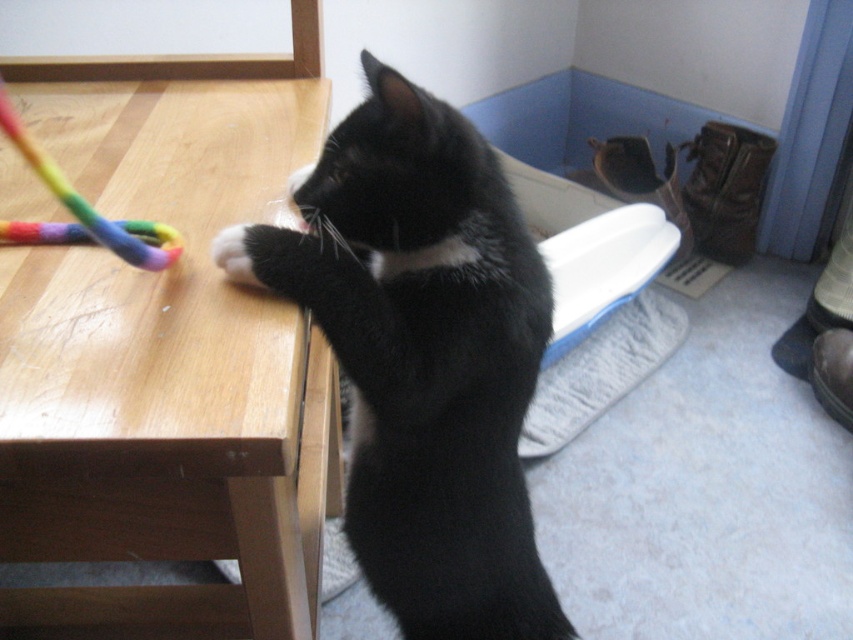
Between wooden table at left and black fur cat at center, which one has less height?

wooden table at left

Is wooden table at left above black fur cat at center?

Correct, wooden table at left is located above black fur cat at center.

Is point (157, 392) positioned after point (473, 497)?

No, it is not.

Where is `wooden table at left`? The width and height of the screenshot is (853, 640). wooden table at left is located at coordinates (165, 372).

Is rainbow fabric toy at left in front of white fur at upper center?

Yes, it is in front of white fur at upper center.

Does point (36, 224) come behind point (225, 252)?

Yes, point (36, 224) is behind point (225, 252).

The height and width of the screenshot is (640, 853). I want to click on rainbow fabric toy at left, so click(82, 211).

Who is positioned more to the left, wooden table at left or white fur at upper center?

wooden table at left

Which is more to the right, wooden table at left or white fur at upper center?

white fur at upper center is more to the right.

Does point (281, 358) come farther from viewer compared to point (236, 260)?

That is False.

Locate an element on the screen. This screenshot has width=853, height=640. wooden table at left is located at coordinates [x=165, y=372].